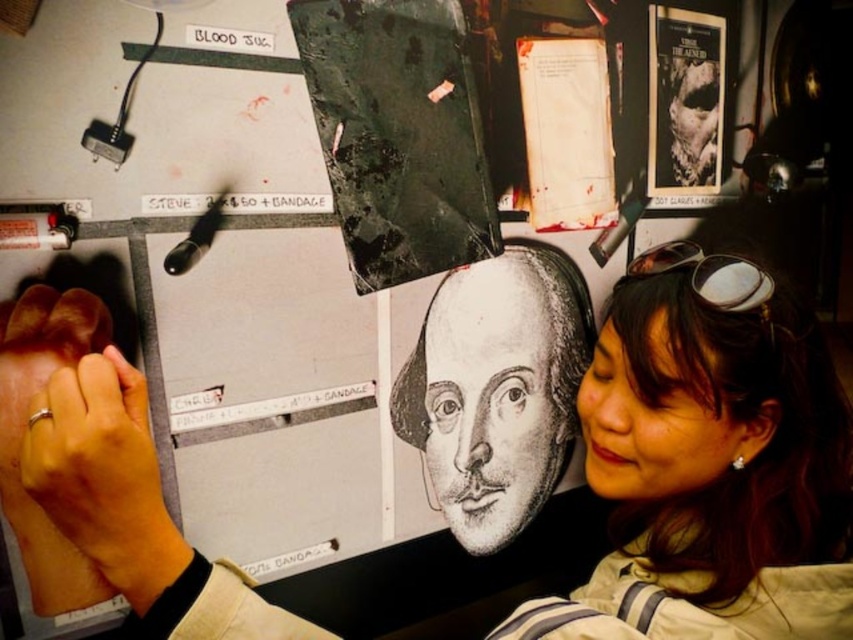
Question: Considering the real-world distances, which object is farthest from the matte black face at center?

Choices:
 (A) hardcover book at upper right
 (B) smooth skin face at lower right
 (C) white paper at upper right

Answer: (A)

Question: Estimate the real-world distances between objects in this image. Which object is farther from the black paper at center?

Choices:
 (A) white paper at upper right
 (B) hardcover book at upper right
 (C) smooth skin face at lower right
 (D) matte black face at center

Answer: (B)

Question: Is black paper at center smaller than smooth skin face at lower right?

Choices:
 (A) yes
 (B) no

Answer: (B)

Question: Which object is positioned farthest from the hardcover book at upper right?

Choices:
 (A) smooth skin face at lower right
 (B) black paper at center
 (C) white paper at upper right

Answer: (A)

Question: Does black paper at center have a larger size compared to hardcover book at upper right?

Choices:
 (A) no
 (B) yes

Answer: (B)

Question: From the image, what is the correct spatial relationship of matte black face at center in relation to hardcover book at upper right?

Choices:
 (A) right
 (B) left

Answer: (B)